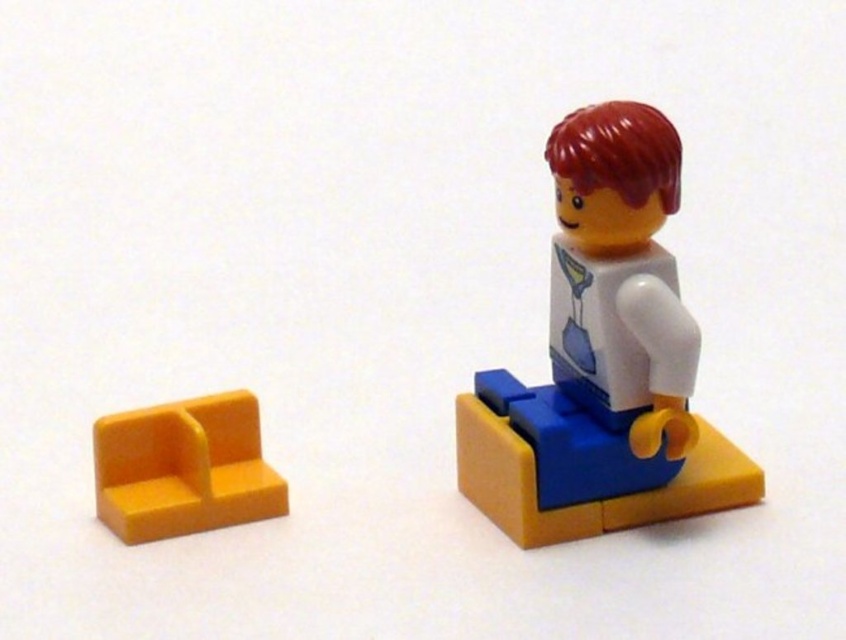
Is white plastic minifigure at center to the left of yellow plastic seat at lower left from the viewer's perspective?

Incorrect, white plastic minifigure at center is not on the left side of yellow plastic seat at lower left.

This screenshot has width=846, height=640. Find the location of `white plastic minifigure at center`. white plastic minifigure at center is located at coordinates (603, 356).

Is point (667, 182) positioned behind point (257, 509)?

No, it is in front of (257, 509).

The height and width of the screenshot is (640, 846). In order to click on white plastic minifigure at center in this screenshot , I will do `click(603, 356)`.